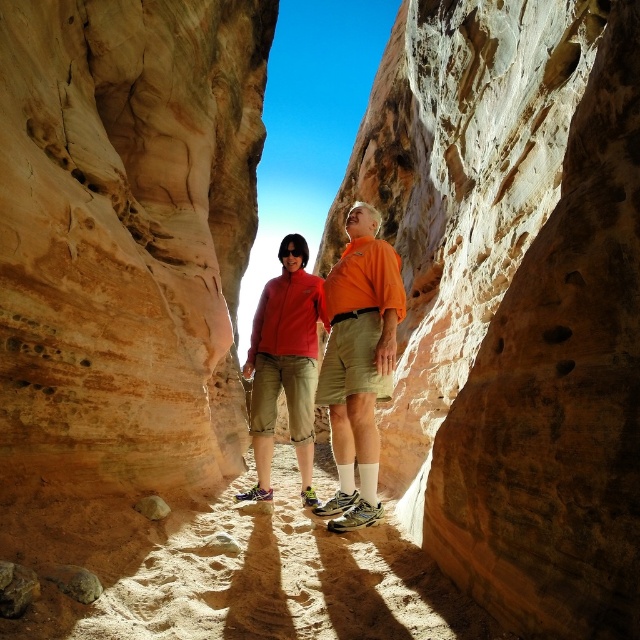
Is matte orange shirt at center in front of smooth brown rock at lower center?

Yes, it is.

Is point (323, 512) less distant than point (152, 497)?

That is False.

Where is `matte orange shirt at center`? The image size is (640, 640). matte orange shirt at center is located at coordinates (358, 362).

The height and width of the screenshot is (640, 640). I want to click on matte orange shirt at center, so click(x=358, y=362).

I want to click on khaki shorts at center, so click(x=284, y=364).

Is khaki shorts at center to the left of smooth brown rock at lower center from the viewer's perspective?

In fact, khaki shorts at center is to the right of smooth brown rock at lower center.

Image resolution: width=640 pixels, height=640 pixels. In order to click on khaki shorts at center in this screenshot , I will do `click(284, 364)`.

Based on the photo, which of these two, khaki shorts at center or smooth brown rock at lower left, stands taller?

Standing taller between the two is khaki shorts at center.

Is khaki shorts at center to the left of smooth brown rock at lower left from the viewer's perspective?

No, khaki shorts at center is not to the left of smooth brown rock at lower left.

What do you see at coordinates (284, 364) in the screenshot? This screenshot has height=640, width=640. I see `khaki shorts at center` at bounding box center [284, 364].

Find the location of a particular element. The image size is (640, 640). khaki shorts at center is located at coordinates (284, 364).